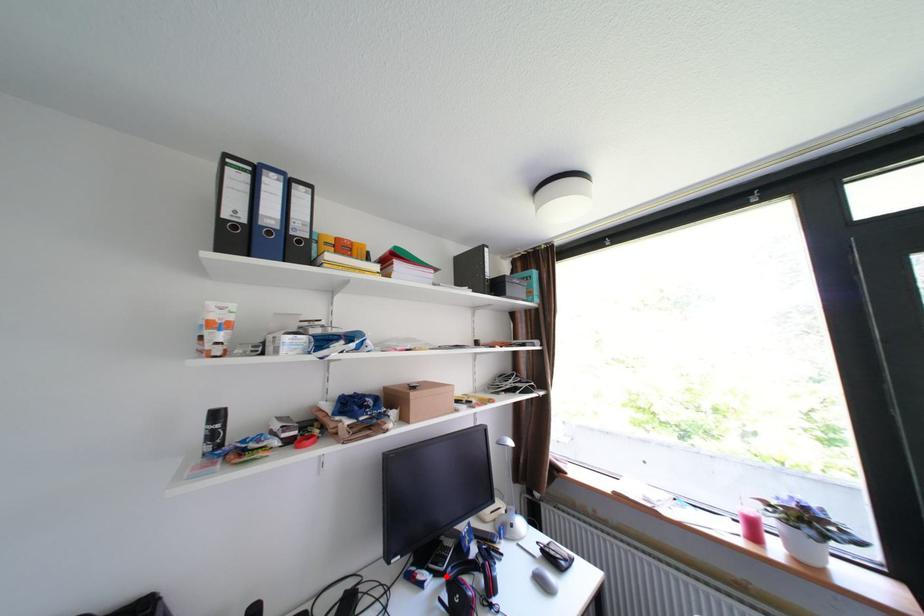
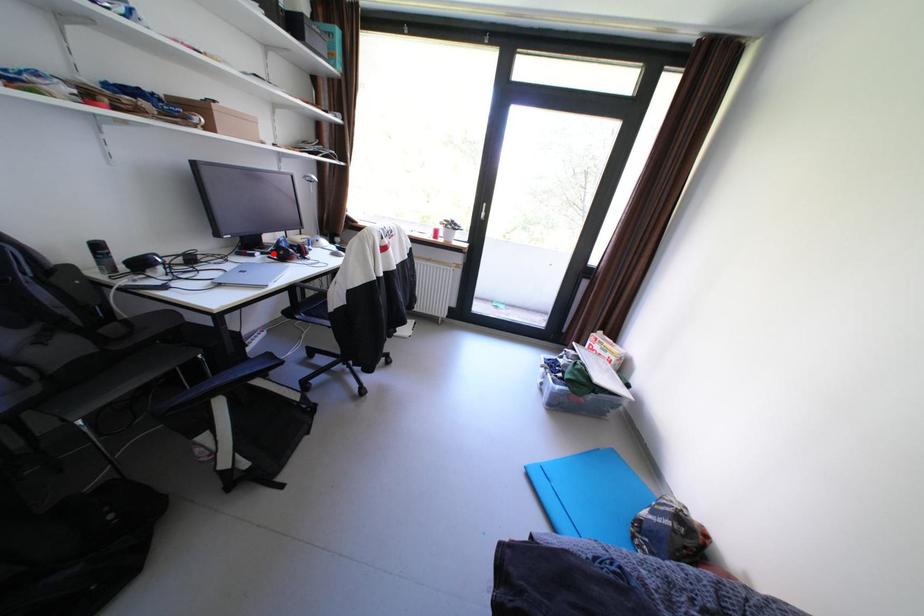
I am providing you with two images of the same scene from different viewpoints. A red point is marked on the first image and another point is marked on the second image. Does the point marked in image1 correspond to the same location as the one in image2?

Yes